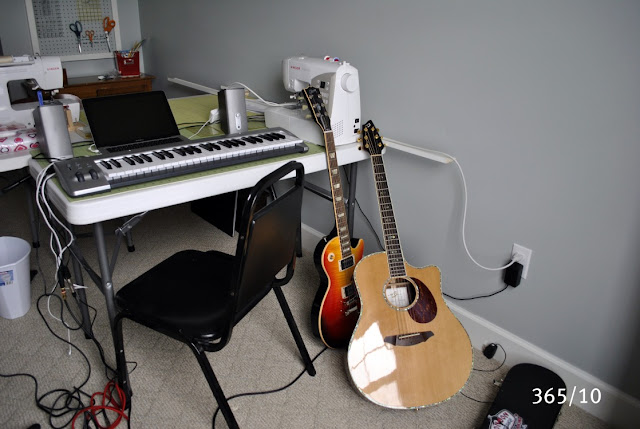
This screenshot has width=640, height=429. In order to click on floor in this screenshot , I will do `click(348, 403)`.